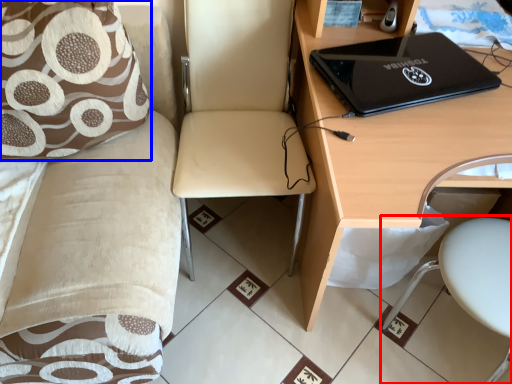
Question: Which of the following is the closest to the observer, swivel chair (highlighted by a red box) or pillow (highlighted by a blue box)?

Choices:
 (A) swivel chair
 (B) pillow

Answer: (B)